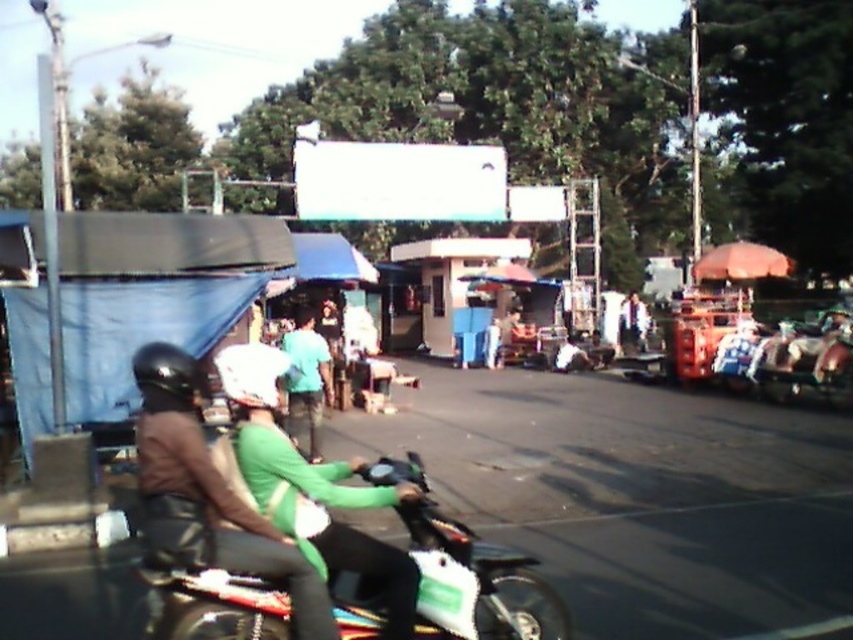
You are a delivery person who needs to choose a helmet for your delivery bike. You see two helmets on the left side of the image, a matte black helmet at left and a black matte helmet at left. Which one is bigger?

The matte black helmet at left is larger in size compared to the black matte helmet at left.

You are a pedestrian standing on the sidewalk and see the black matte helmet at left and the white matte helmet at center. Which helmet is closer to you?

The black matte helmet at left is closer to you because it is positioned in front of the white matte helmet at center.